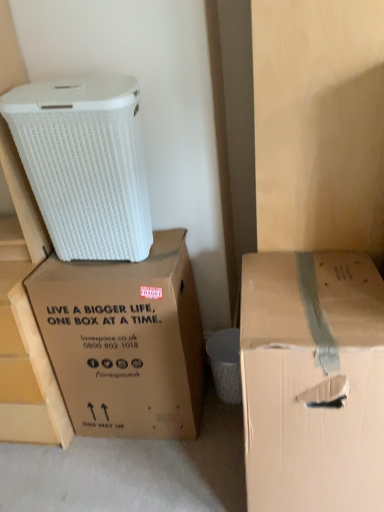
Question: From their relative heights in the image, would you say brown cardboard box at right, positioned as the first box in right-to-left order, is taller or shorter than brown cardboard box at center, the 2th box viewed from the right?

Choices:
 (A) short
 (B) tall

Answer: (B)

Question: From the image's perspective, relative to brown cardboard box at center, the 2th box viewed from the right, is brown cardboard box at right, the second box positioned from the left, above or below?

Choices:
 (A) above
 (B) below

Answer: (B)

Question: Which object is positioned closest to the brown cardboard box at right, positioned as the first box in right-to-left order?

Choices:
 (A) white matte cardboard box at upper left
 (B) brown cardboard box at center, the 2th box viewed from the right

Answer: (B)

Question: Which of these objects is positioned farthest from the brown cardboard box at right, the second box positioned from the left?

Choices:
 (A) white matte cardboard box at upper left
 (B) brown cardboard box at center, the 2th box viewed from the right

Answer: (A)